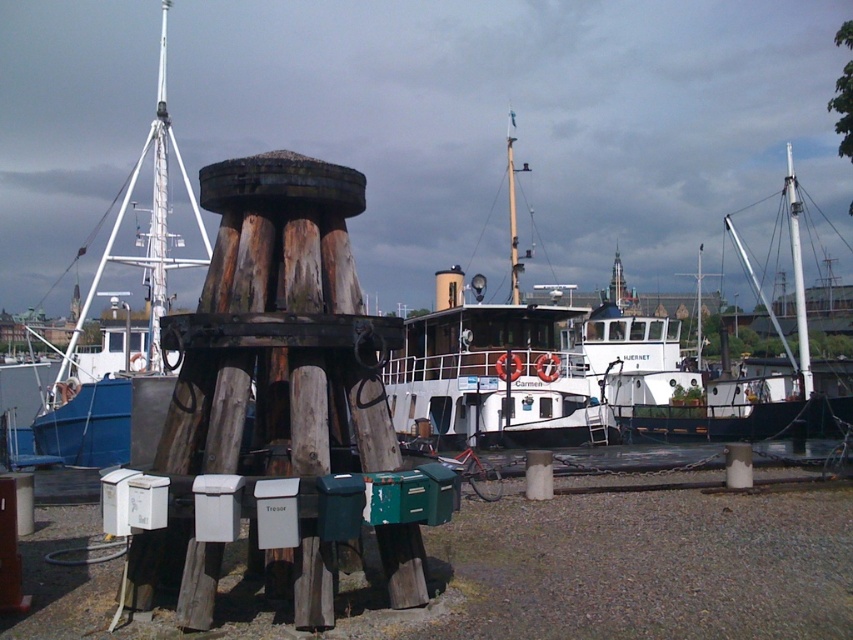
You are a dock worker who needs to secure both the white matte boat at center and the blue painted wood boat at left. Since you can only access one boat at a time, which boat should you secure first based on their current positions?

The white matte boat at center should be secured first because it is in front of the blue painted wood boat at left, making it more accessible.

You are a dock worker who needs to secure both the white matte boat at center and the white wooden boat at center to the bollard. Given that the rope you have is 8 meters long, will it be sufficient to tie both boats to the bollard without needing a longer rope?

The white matte boat at center is 8.40 meters from the white wooden boat at center. Since the rope is only 8 meters long, it is not long enough to secure both boats to the bollard as the distance between them exceeds the rope length.

You are standing at the wooden bollard in the foreground of the marina scene. Looking towards the blue painted wood boat at left, which is represented by the point at coordinates (126, 326), can you determine if the boat is positioned to the left or right of the bollard?

The blue painted wood boat at left is positioned to the left of the bollard as indicated by its coordinates at (126, 326).